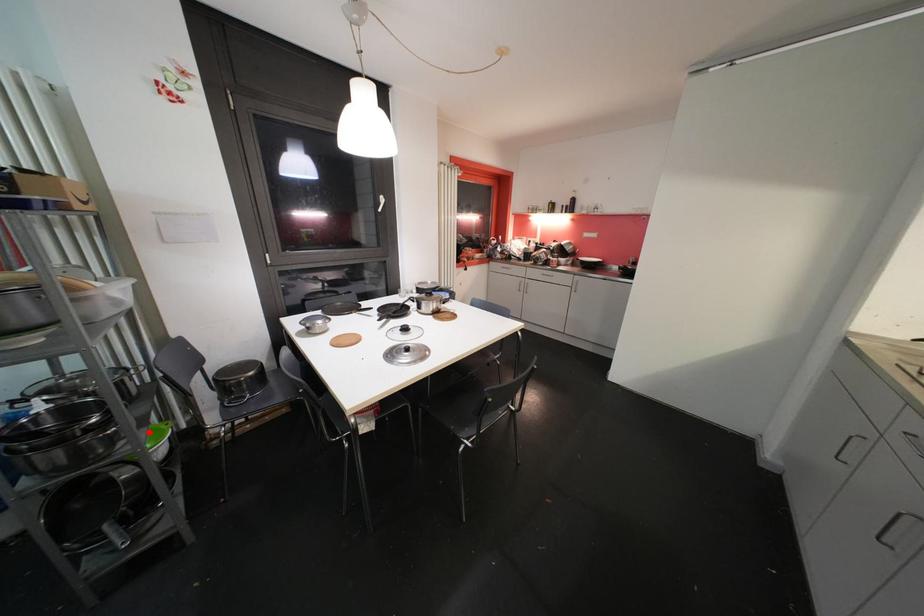
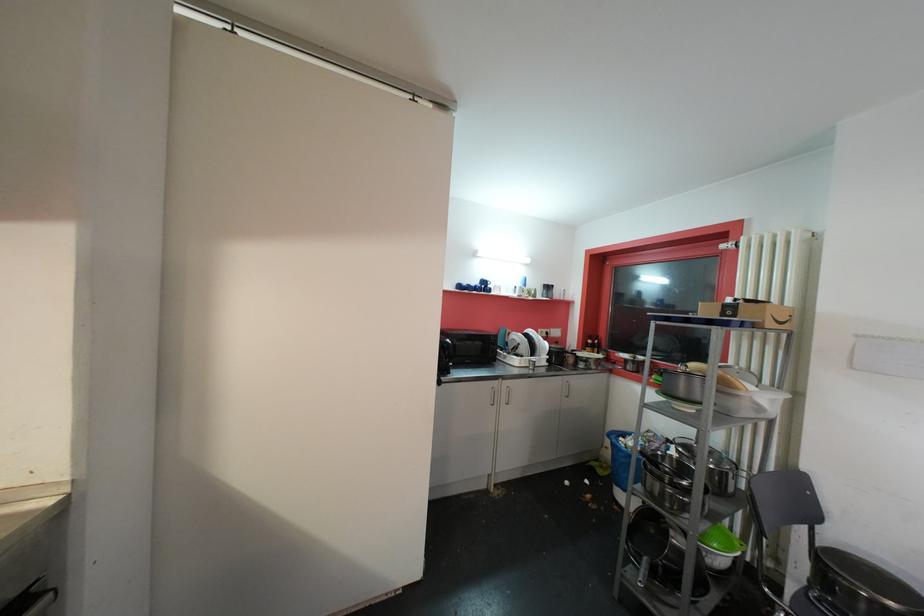
Locate, in the second image, the point that corresponds to the highlighted location in the first image.

(713, 525)